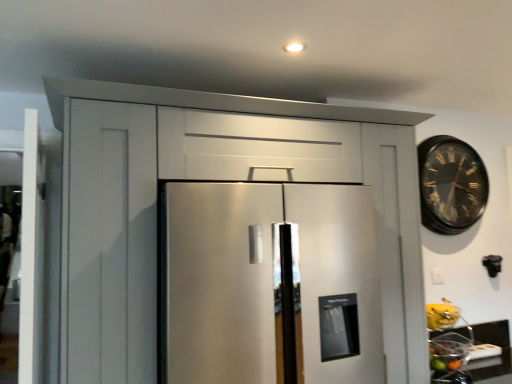
Question: Can you confirm if matte black countertop at lower right is taller than yellow matte bananas at lower right, the 2th fruit when ordered from bottom to top?

Choices:
 (A) no
 (B) yes

Answer: (A)

Question: Would you say matte black countertop at lower right is a long distance from yellow matte bananas at lower right, the 2th fruit when ordered from bottom to top?

Choices:
 (A) yes
 (B) no

Answer: (B)

Question: Considering the relative sizes of matte black countertop at lower right and yellow matte bananas at lower right, the first fruit in the top-to-bottom sequence, in the image provided, is matte black countertop at lower right thinner than yellow matte bananas at lower right, the first fruit in the top-to-bottom sequence,?

Choices:
 (A) yes
 (B) no

Answer: (A)

Question: Does matte black countertop at lower right have a lesser height compared to yellow matte bananas at lower right, the first fruit in the top-to-bottom sequence?

Choices:
 (A) yes
 (B) no

Answer: (A)

Question: Is yellow matte bananas at lower right, the first fruit in the top-to-bottom sequence, surrounded by matte black countertop at lower right?

Choices:
 (A) yes
 (B) no

Answer: (B)

Question: Is matte black countertop at lower right bigger or smaller than shiny metallic bowl at lower right, the first fruit when ordered from bottom to top?

Choices:
 (A) small
 (B) big

Answer: (B)

Question: Is matte black countertop at lower right to the left or to the right of shiny metallic bowl at lower right, which ranks as the second fruit in top-to-bottom order, in the image?

Choices:
 (A) right
 (B) left

Answer: (A)

Question: From a real-world perspective, relative to shiny metallic bowl at lower right, the first fruit when ordered from bottom to top, is matte black countertop at lower right vertically above or below?

Choices:
 (A) above
 (B) below

Answer: (B)

Question: Considering the positions of matte black countertop at lower right and shiny metallic bowl at lower right, the first fruit when ordered from bottom to top, in the image, is matte black countertop at lower right taller or shorter than shiny metallic bowl at lower right, the first fruit when ordered from bottom to top,?

Choices:
 (A) tall
 (B) short

Answer: (A)

Question: Choose the correct answer: Is matte black countertop at lower right inside stainless steel refrigerator at center or outside it?

Choices:
 (A) inside
 (B) outside

Answer: (B)

Question: Considering the positions of matte black countertop at lower right and stainless steel refrigerator at center in the image, is matte black countertop at lower right bigger or smaller than stainless steel refrigerator at center?

Choices:
 (A) big
 (B) small

Answer: (B)

Question: Based on their positions, is matte black countertop at lower right located to the left or right of stainless steel refrigerator at center?

Choices:
 (A) left
 (B) right

Answer: (B)

Question: Relative to stainless steel refrigerator at center, is matte black countertop at lower right in front or behind?

Choices:
 (A) behind
 (B) front

Answer: (A)

Question: From their relative heights in the image, would you say satin white cabinet at center is taller or shorter than shiny metallic bowl at lower right, the first fruit when ordered from bottom to top?

Choices:
 (A) short
 (B) tall

Answer: (B)

Question: From a real-world perspective, is satin white cabinet at center positioned above or below shiny metallic bowl at lower right, which ranks as the second fruit in top-to-bottom order?

Choices:
 (A) below
 (B) above

Answer: (B)